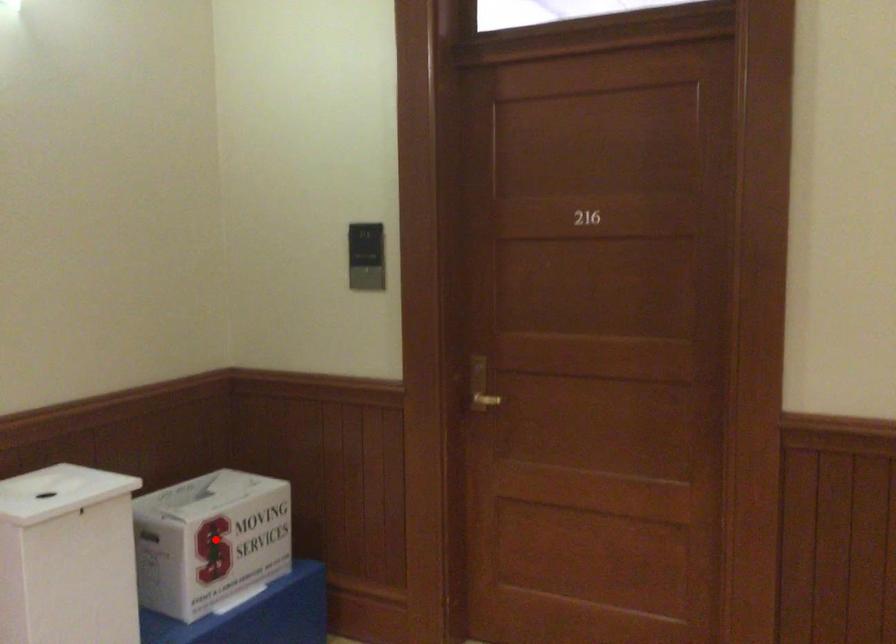
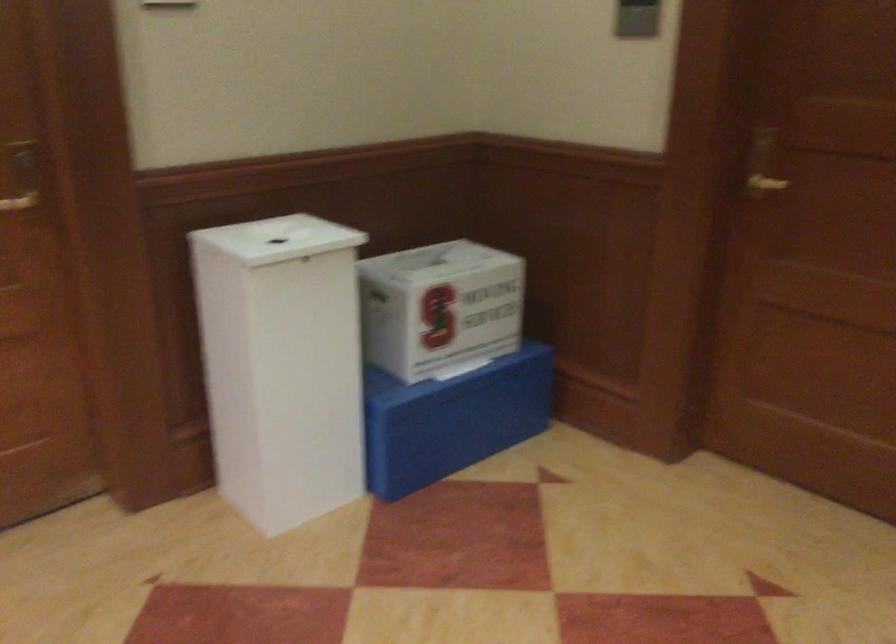
In the second image, find the point that corresponds to the highlighted location in the first image.

(440, 307)